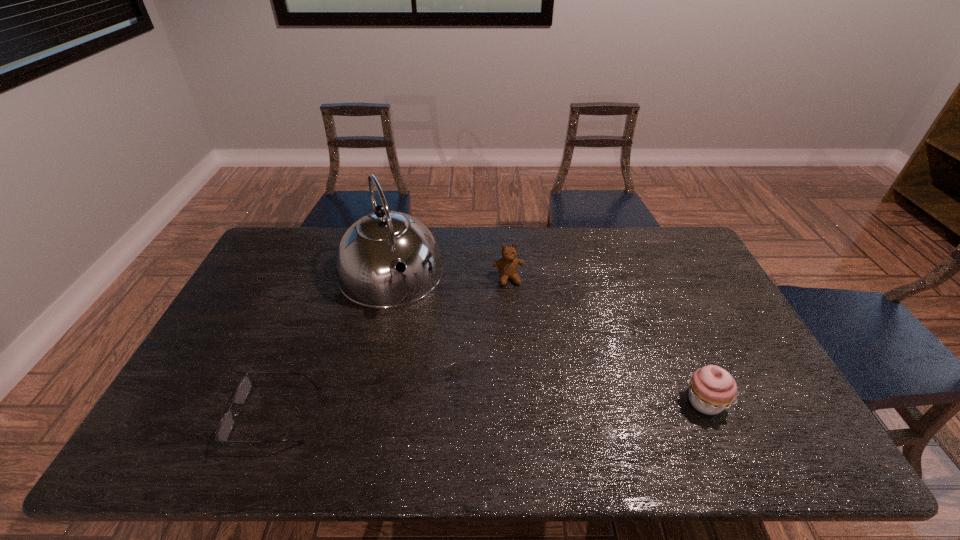
The height and width of the screenshot is (540, 960). I want to click on spectacles, so click(x=226, y=424).

Identify the location of cupcake. The width and height of the screenshot is (960, 540). (712, 389).

Where is `the tallest object`? This screenshot has height=540, width=960. the tallest object is located at coordinates (368, 252).

Identify the location of the second object from right to left. This screenshot has width=960, height=540. (507, 266).

The image size is (960, 540). Find the location of `vacant space located 0.160m on the front-facing side of the spectacles`. vacant space located 0.160m on the front-facing side of the spectacles is located at coordinates (171, 415).

Find the location of a particular element. This screenshot has height=540, width=960. vacant space located 0.060m on the front-facing side of the spectacles is located at coordinates (211, 415).

The width and height of the screenshot is (960, 540). I want to click on vacant space positioned on the front-facing side of the spectacles, so click(179, 415).

Find the location of a particular element. The width and height of the screenshot is (960, 540). vacant space located on the right of the cupcake is located at coordinates pos(748,402).

The width and height of the screenshot is (960, 540). Find the location of `vacant region located from the spout of the tallest object`. vacant region located from the spout of the tallest object is located at coordinates (413, 330).

In order to click on free space located 0.360m from the spout of the tallest object in this screenshot , I will do point(444,405).